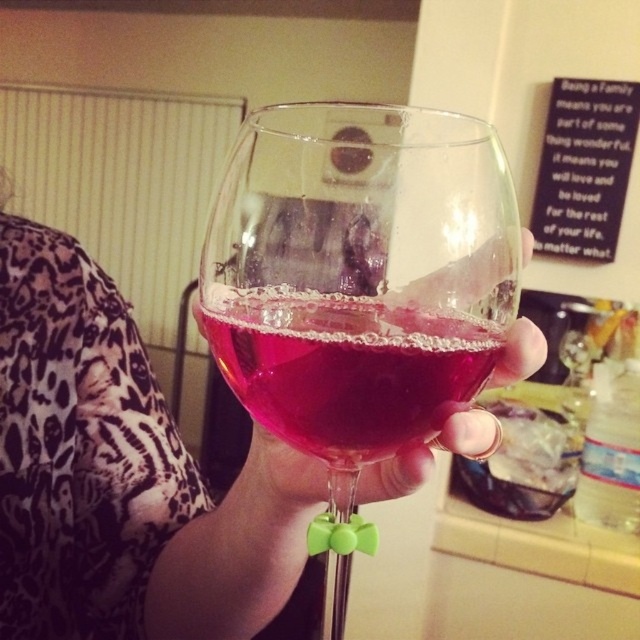
Is transparent glass at center further to camera compared to translucent glass wine at center?

Yes, transparent glass at center is further from the viewer.

Is transparent glass at center shorter than translucent glass wine at center?

In fact, transparent glass at center may be taller than translucent glass wine at center.

Is point (451, 381) farther from camera compared to point (330, 442)?

No.

The image size is (640, 640). I want to click on transparent glass at center, so click(358, 275).